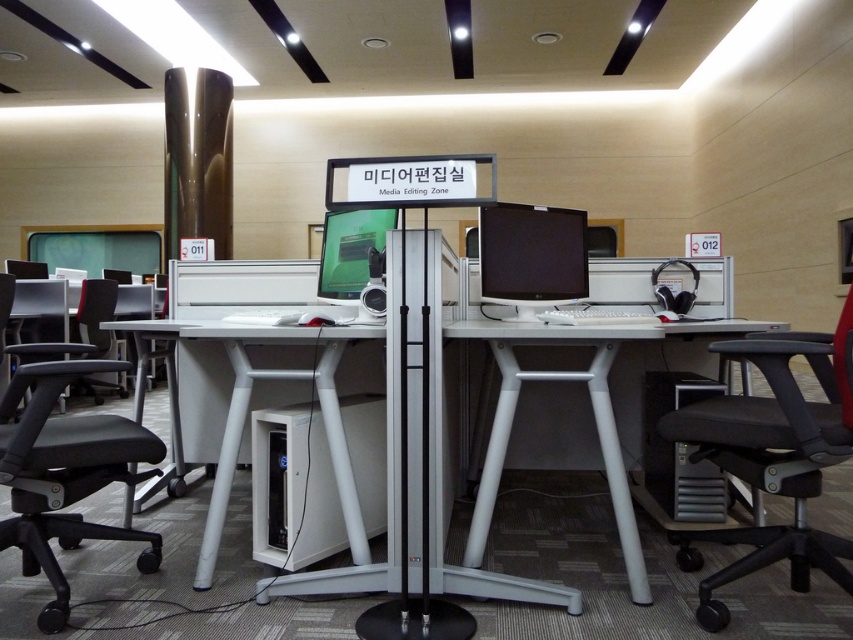
You are standing at the entrance of the office and want to move to the black fabric office chair at right. Based on the 2D coordinates provided, what are the coordinates of the chair?

The coordinates of the black fabric office chair at right are at point (773, 456).

You are an office worker who needs to move a large box from the desk to the storage room. The box is too wide to carry through the narrow hallway. You decide to roll it across the floor. Which object between the black fabric office chair at right and the white plastic table at center would you use as a path, considering their widths?

The black fabric office chair at right has a smaller width than the white plastic table at center, so you should use the path next to the black fabric office chair at right since it is narrower and might allow the large box to pass through the narrow hallway more easily.

You are a delivery person who needs to place a small package on the white plastic table at center. Based on the coordinates provided, can you confirm the exact location where you should place the package?

The white plastic table at center is located at coordinates point (590, 404), so place the package there.